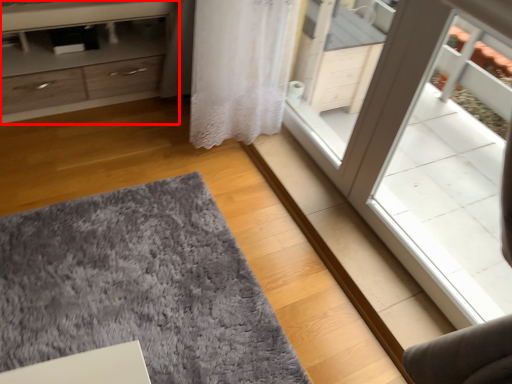
Question: In this image, where is chest of drawers (annotated by the red box) located relative to doormat?

Choices:
 (A) left
 (B) right

Answer: (A)